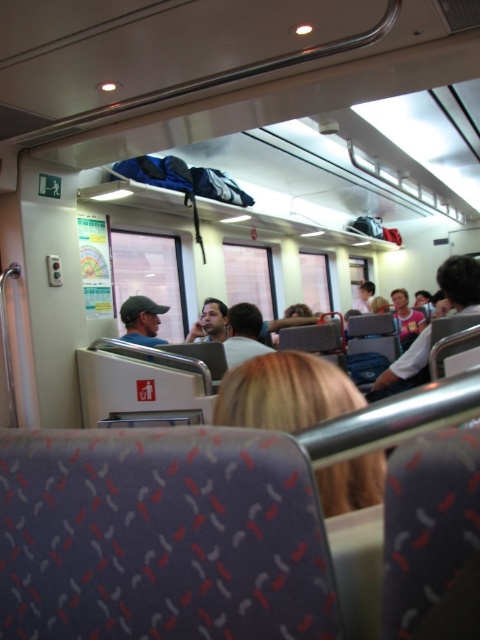
Question: Is blonde hair at center wider than smooth skin face at center?

Choices:
 (A) no
 (B) yes

Answer: (A)

Question: Which point is closer to the camera?

Choices:
 (A) (396, 362)
 (B) (264, 410)
 (C) (215, 323)
 (D) (412, 314)

Answer: (B)

Question: Which point appears closest to the camera in this image?

Choices:
 (A) (400, 323)
 (B) (385, 387)
 (C) (326, 508)
 (D) (226, 310)

Answer: (C)

Question: Is blonde hair at center thinner than white shirt at right?

Choices:
 (A) no
 (B) yes

Answer: (B)

Question: Does blonde hair at center have a smaller size compared to white shirt at right?

Choices:
 (A) yes
 (B) no

Answer: (A)

Question: Which point appears farthest from the camera in this image?

Choices:
 (A) (196, 323)
 (B) (477, 268)

Answer: (A)